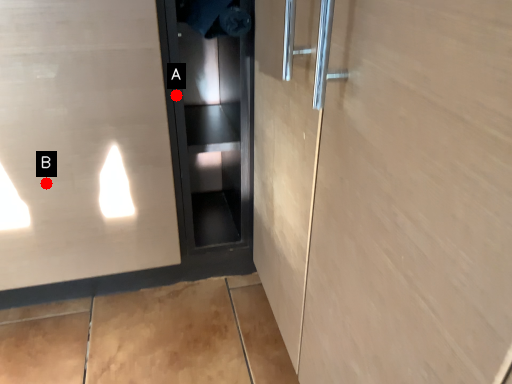
Question: Two points are circled on the image, labeled by A and B beside each circle. Which point is closer to the camera?

Choices:
 (A) A is closer
 (B) B is closer

Answer: (A)